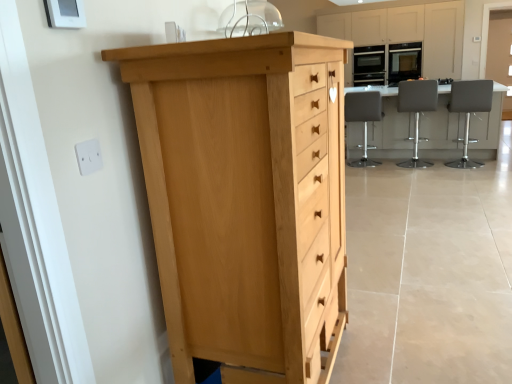
Image resolution: width=512 pixels, height=384 pixels. In order to click on white leather stool at center, which is counted as the first chair, starting from the left in this screenshot , I will do `click(362, 118)`.

What is the approximate height of gray leather bar stool at right, which is counted as the 3th chair, starting from the left?

It is 1.03 meters.

In order to face gray leather bar stool at right, which is counted as the 3th chair, starting from the left, should I rotate leftwards or rightwards?

It's best to rotate right around 26.221 degrees.

Locate an element on the screen. The width and height of the screenshot is (512, 384). white glossy table at center is located at coordinates (389, 121).

What do you see at coordinates (389, 121) in the screenshot? The height and width of the screenshot is (384, 512). I see `white glossy table at center` at bounding box center [389, 121].

What do you see at coordinates (417, 110) in the screenshot?
I see `leatherette stool at center, marked as the 2th chair in a left-to-right arrangement` at bounding box center [417, 110].

The height and width of the screenshot is (384, 512). What do you see at coordinates (89, 156) in the screenshot?
I see `white plastic electric outlet at upper left` at bounding box center [89, 156].

What do you see at coordinates (404, 62) in the screenshot? I see `matte black oven at upper right, acting as the 1th appliance starting from the right` at bounding box center [404, 62].

This screenshot has width=512, height=384. I want to click on transparent glass door at upper right, so click(x=499, y=47).

In order to face transparent glass door at upper right, should I rotate leftwards or rightwards?

To align with it, rotate right about 30.094°.

The image size is (512, 384). I want to click on white leather stool at center, the 3th chair positioned from the right, so click(x=362, y=118).

Looking at this image, is light wood chest of drawers at left facing towards gray leather bar stool at right, the first chair from the right?

No, light wood chest of drawers at left is not oriented towards gray leather bar stool at right, the first chair from the right.

Considering the relative sizes of light wood chest of drawers at left and gray leather bar stool at right, the first chair from the right, in the image provided, is light wood chest of drawers at left bigger than gray leather bar stool at right, the first chair from the right,?

Yes.

What's the angular difference between light wood chest of drawers at left and gray leather bar stool at right, the first chair from the right,'s facing directions?

91.3 degrees.

Measure the distance between light wood chest of drawers at left and gray leather bar stool at right, the first chair from the right.

They are 4.50 meters apart.

Which of these two, matte black oven at upper right, acting as the 1th appliance starting from the right, or transparent glass door at upper right, is wider?

Wider between the two is matte black oven at upper right, acting as the 1th appliance starting from the right.

Can you confirm if matte black oven at upper right, the second appliance in the left-to-right sequence, is smaller than transparent glass door at upper right?

Yes.

Is matte black oven at upper right, the second appliance in the left-to-right sequence, behind transparent glass door at upper right?

No, it is in front of transparent glass door at upper right.

From the image's perspective, does matte black oven at upper right, the second appliance in the left-to-right sequence, appear lower than transparent glass door at upper right?

Yes, from the image's perspective, matte black oven at upper right, the second appliance in the left-to-right sequence, is below transparent glass door at upper right.

Can you confirm if leatherette stool at center, marked as the 2th chair in a left-to-right arrangement, is thinner than matte light wood cabinets at upper center?

Yes, leatherette stool at center, marked as the 2th chair in a left-to-right arrangement, is thinner than matte light wood cabinets at upper center.

Can you confirm if leatherette stool at center, marked as the 2th chair in a left-to-right arrangement, is bigger than matte light wood cabinets at upper center?

Actually, leatherette stool at center, marked as the 2th chair in a left-to-right arrangement, might be smaller than matte light wood cabinets at upper center.

Could you tell me if leatherette stool at center, the 2th chair positioned from the right, is facing matte light wood cabinets at upper center?

Yes.

Considering the positions of objects transparent glass door at upper right and white plastic electric outlet at upper left in the image provided, who is in front, transparent glass door at upper right or white plastic electric outlet at upper left?

white plastic electric outlet at upper left is in front.

Between transparent glass door at upper right and white plastic electric outlet at upper left, which one has less height?

Standing shorter between the two is white plastic electric outlet at upper left.

Which is closer to the camera, (x=494, y=24) or (x=85, y=158)?

The point (x=85, y=158) is more forward.

From the image's perspective, which is below, transparent glass door at upper right or white plastic electric outlet at upper left?

From the image's view, white plastic electric outlet at upper left is below.

Between white glossy table at center and white leather stool at center, the 3th chair positioned from the right, which one appears on the left side from the viewer's perspective?

Positioned to the left is white leather stool at center, the 3th chair positioned from the right.

Could you tell me if white glossy table at center is turned towards white leather stool at center, the 3th chair positioned from the right?

No.

From the image's perspective, is white glossy table at center located above or below white leather stool at center, which is counted as the first chair, starting from the left?

Based on their image positions, white glossy table at center is located above white leather stool at center, which is counted as the first chair, starting from the left.

Can you confirm if white glossy table at center is smaller than white leather stool at center, the 3th chair positioned from the right?

Actually, white glossy table at center might be larger than white leather stool at center, the 3th chair positioned from the right.

Between matte black oven at upper right, the second appliance in the left-to-right sequence, and white leather stool at center, which is counted as the first chair, starting from the left, which one has smaller width?

With smaller width is matte black oven at upper right, the second appliance in the left-to-right sequence.

Is matte black oven at upper right, acting as the 1th appliance starting from the right, aimed at white leather stool at center, which is counted as the first chair, starting from the left?

Yes, matte black oven at upper right, acting as the 1th appliance starting from the right, is turned towards white leather stool at center, which is counted as the first chair, starting from the left.

Which object is positioned more to the right, matte black oven at upper right, the second appliance in the left-to-right sequence, or white leather stool at center, the 3th chair positioned from the right?

matte black oven at upper right, the second appliance in the left-to-right sequence.

Is point (488, 64) farther from camera compared to point (154, 98)?

Yes, point (488, 64) is farther from viewer.

From the picture: Does transparent glass door at upper right turn towards light wood chest of drawers at left?

No, transparent glass door at upper right is not aimed at light wood chest of drawers at left.

Is transparent glass door at upper right beside light wood chest of drawers at left?

No, transparent glass door at upper right is not next to light wood chest of drawers at left.

Starting from the light wood chest of drawers at left, which chair is the 1st one behind? Please provide its 2D coordinates.

[(469, 111)]

Find the location of a particular element. The height and width of the screenshot is (384, 512). the 2nd appliance in front of the transparent glass door at upper right is located at coordinates (404, 62).

When comparing their distances from white glossy table at center, does matte black oven at upper right, marked as the second appliance in a right-to-left arrangement, or white leather stool at center, the 3th chair positioned from the right, seem further?

matte black oven at upper right, marked as the second appliance in a right-to-left arrangement, lies further to white glossy table at center than the other object.

Based on their spatial positions, is matte black oven at upper right, the second appliance in the left-to-right sequence, or leatherette stool at center, the 2th chair positioned from the right, further from white leather stool at center, which is counted as the first chair, starting from the left?

Based on the image, matte black oven at upper right, the second appliance in the left-to-right sequence, appears to be further to white leather stool at center, which is counted as the first chair, starting from the left.

Estimate the real-world distances between objects in this image. Which object is closer to white plastic electric outlet at upper left, leatherette stool at center, marked as the 2th chair in a left-to-right arrangement, or matte black oven at upper right, placed as the 1th appliance when sorted from left to right?

Among the two, leatherette stool at center, marked as the 2th chair in a left-to-right arrangement, is located nearer to white plastic electric outlet at upper left.

Looking at the image, which one is located closer to matte light wood cabinets at upper center, matte black oven at upper right, marked as the second appliance in a right-to-left arrangement, or white glossy table at center?

matte black oven at upper right, marked as the second appliance in a right-to-left arrangement, is positioned closer to the anchor matte light wood cabinets at upper center.

Based on their spatial positions, is light wood chest of drawers at left or matte black oven at upper right, placed as the 1th appliance when sorted from left to right, closer to matte black oven at upper right, acting as the 1th appliance starting from the right?

matte black oven at upper right, placed as the 1th appliance when sorted from left to right, is positioned closer to the anchor matte black oven at upper right, acting as the 1th appliance starting from the right.

Considering their positions, is leatherette stool at center, marked as the 2th chair in a left-to-right arrangement, positioned closer to transparent glass door at upper right than white leather stool at center, which is counted as the first chair, starting from the left?

Among the two, leatherette stool at center, marked as the 2th chair in a left-to-right arrangement, is located nearer to transparent glass door at upper right.

Which object lies further to the anchor point white leather stool at center, which is counted as the first chair, starting from the left, matte black oven at upper right, the second appliance in the left-to-right sequence, or light wood chest of drawers at left?

light wood chest of drawers at left is further to white leather stool at center, which is counted as the first chair, starting from the left.

Estimate the real-world distances between objects in this image. Which object is closer to white leather stool at center, the 3th chair positioned from the right, transparent glass door at upper right or white plastic electric outlet at upper left?

transparent glass door at upper right lies closer to white leather stool at center, the 3th chair positioned from the right, than the other object.

Identify the location of electric outlet between light wood chest of drawers at left and matte black oven at upper right, placed as the 1th appliance when sorted from left to right, from front to back. (89, 156).

Locate an element on the screen. Image resolution: width=512 pixels, height=384 pixels. chair positioned between white plastic electric outlet at upper left and white glossy table at center from near to far is located at coordinates (469, 111).

Where is `appliance between matte light wood cabinets at upper center and matte black oven at upper right, marked as the second appliance in a right-to-left arrangement, from front to back`? appliance between matte light wood cabinets at upper center and matte black oven at upper right, marked as the second appliance in a right-to-left arrangement, from front to back is located at coordinates (404, 62).

At what (x,y) coordinates should I click in order to perform the action: click on cabinetry located between gray leather bar stool at right, which is counted as the 3th chair, starting from the left, and transparent glass door at upper right in the depth direction. Please return your answer as a coordinate pair (x, y). Image resolution: width=512 pixels, height=384 pixels. Looking at the image, I should click on (407, 32).